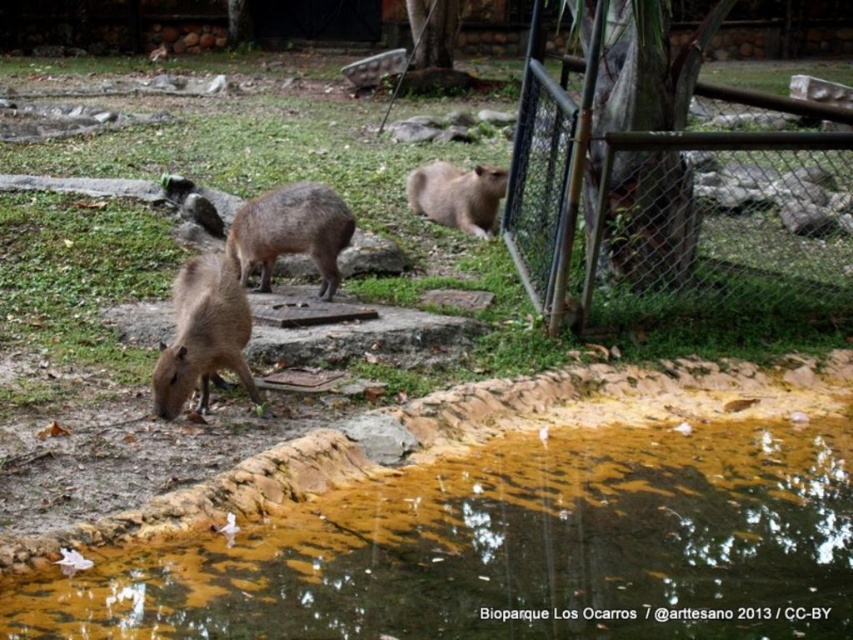
You are a zookeeper at Bioparque Los Ocarros and want to ensure the capybaras don not escape. The enclosure has a metal mesh fence at upper right and a fuzzy brown capybara at center. Which structure is taller, and does this help in containing the animals?

The metal mesh fence at upper right is taller than the fuzzy brown capybara at center, which helps in containing the animals as the fence height prevents them from jumping over.

You are standing in the Bioparque Los Ocarros and want to observe the capybaras grazing in the grassy area. There is a metal mesh fence at upper right. Considering your position relative to the fence, can you comfortably lean forward to get a closer look without touching the fence?

The metal mesh fence at upper right is 14.79 feet away from you, so yes, you can comfortably lean forward to get a closer look without touching the fence since the distance is sufficient.